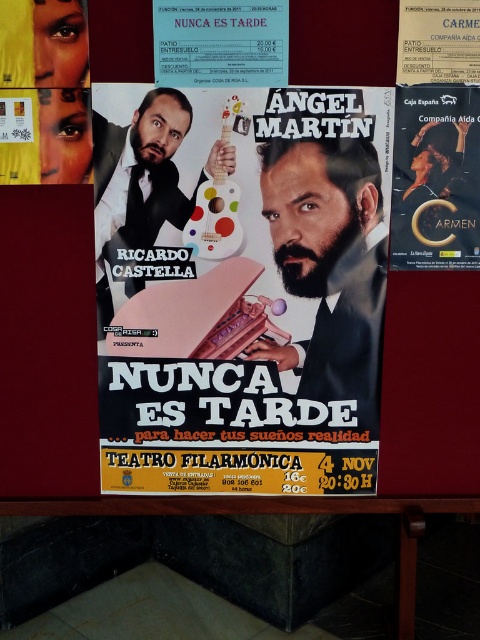
Question: Does matte black suit at center have a larger size compared to matte black poster at upper right?

Choices:
 (A) yes
 (B) no

Answer: (A)

Question: Is the position of matte black suit at center more distant than that of matte black guitar at center?

Choices:
 (A) yes
 (B) no

Answer: (A)

Question: Is matte pink pastel at center smaller than matte black poster at upper right?

Choices:
 (A) yes
 (B) no

Answer: (B)

Question: Which point is farther to the camera?

Choices:
 (A) matte pink pastel at center
 (B) matte black suit at center
 (C) matte black guitar at center

Answer: (B)

Question: Which of the following is the closest to the observer?

Choices:
 (A) (304, 436)
 (B) (96, 193)
 (C) (349, 192)

Answer: (B)

Question: Which object appears farthest from the camera in this image?

Choices:
 (A) matte pink pastel at center
 (B) matte black suit at center
 (C) matte black guitar at center
 (D) matte black poster at upper right

Answer: (B)